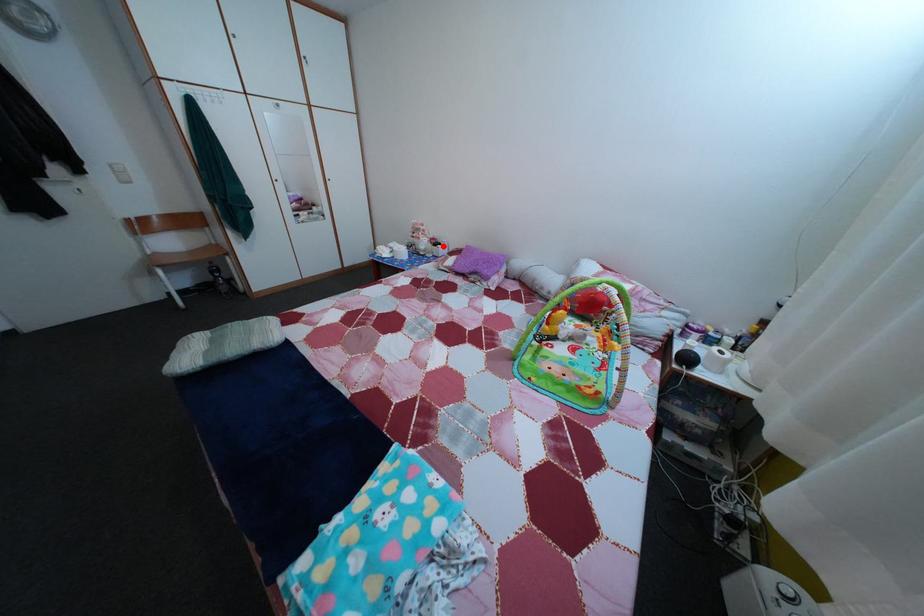
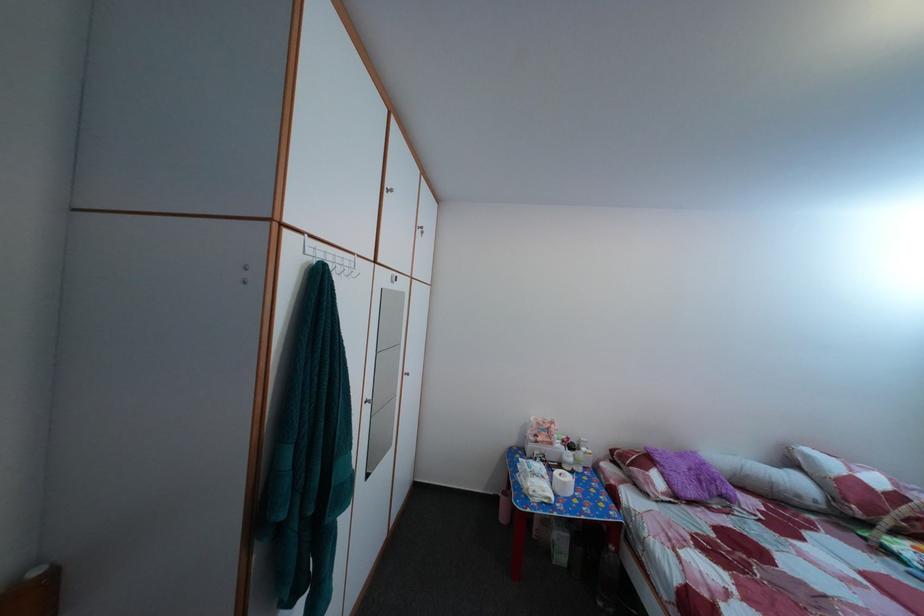
Find the pixel in the second image that matches the highlighted location in the first image.

(578, 447)